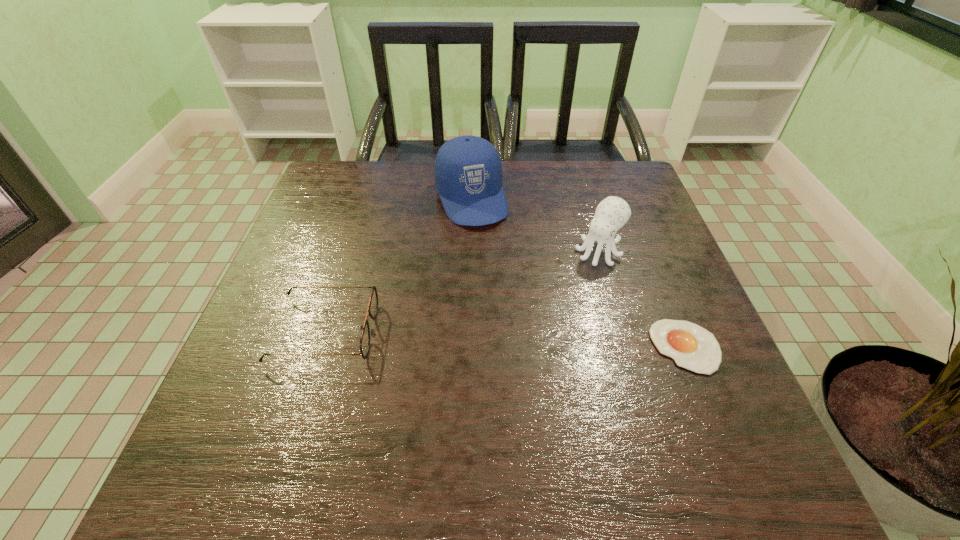
You are a GUI agent. You are given a task and a screenshot of the screen. Output one action in this format:
    pyautogui.click(x=<x>, y=<y>)
    Task: Click on the free spot between the egg yolk and the third object from right to left
    The width and height of the screenshot is (960, 540).
    Given the screenshot: What is the action you would take?
    pyautogui.click(x=579, y=273)

Where is `vacant space that's between the third object from right to left and the shortest object`? Image resolution: width=960 pixels, height=540 pixels. vacant space that's between the third object from right to left and the shortest object is located at coordinates (579, 273).

Where is `unoccupied position between the third object from right to left and the second farthest object`? The height and width of the screenshot is (540, 960). unoccupied position between the third object from right to left and the second farthest object is located at coordinates (535, 225).

Where is `vacant area between the third nearest object and the leftmost object`? This screenshot has height=540, width=960. vacant area between the third nearest object and the leftmost object is located at coordinates tap(462, 292).

The image size is (960, 540). I want to click on free area in between the octopus and the shortest object, so click(642, 299).

This screenshot has width=960, height=540. Identify the location of object that is the third nearest to the cap. (692, 347).

Identify which object is located as the third nearest to the shortest object. Please provide its 2D coordinates. Your answer should be formatted as a tuple, i.e. [(x, y)], where the tuple contains the x and y coordinates of a point satisfying the conditions above.

[(373, 303)]

This screenshot has width=960, height=540. What are the coordinates of `vacant area in the image that satisfies the following two spatial constraints: 1. on the front side of the third object from right to left; 2. on the right side of the second farthest object` in the screenshot? It's located at (470, 252).